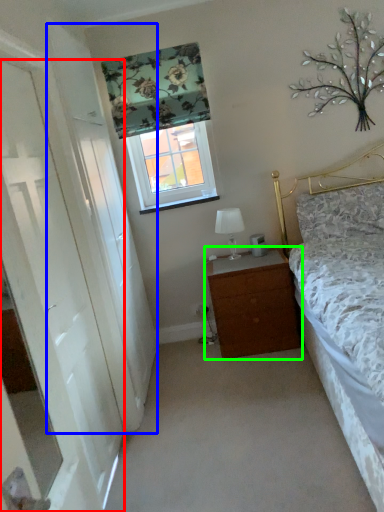
Question: Which object is positioned closest to door (highlighted by a red box)? Select from screen door (highlighted by a blue box) and chest of drawers (highlighted by a green box).

Choices:
 (A) screen door
 (B) chest of drawers

Answer: (A)